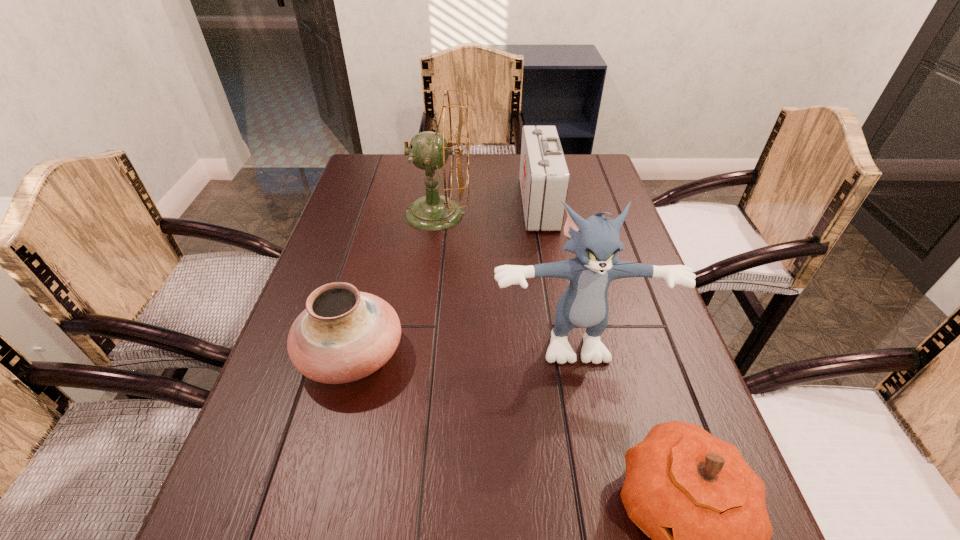
This screenshot has height=540, width=960. Find the location of `free spot between the first-aid kit and the fan`. free spot between the first-aid kit and the fan is located at coordinates (488, 208).

The height and width of the screenshot is (540, 960). What are the coordinates of `vacant area that lies between the pottery and the first-aid kit` in the screenshot? It's located at (445, 279).

The height and width of the screenshot is (540, 960). Find the location of `the closest object relative to the nearest object`. the closest object relative to the nearest object is located at coordinates (595, 241).

Locate which object is the fourth closest to the first-aid kit. Please provide its 2D coordinates. Your answer should be formatted as a tuple, i.e. [(x, y)], where the tuple contains the x and y coordinates of a point satisfying the conditions above.

[(694, 495)]

This screenshot has height=540, width=960. Find the location of `free region that satisfies the following two spatial constraints: 1. in front of the fan, directing air flow; 2. on the front side of the pottery`. free region that satisfies the following two spatial constraints: 1. in front of the fan, directing air flow; 2. on the front side of the pottery is located at coordinates (420, 355).